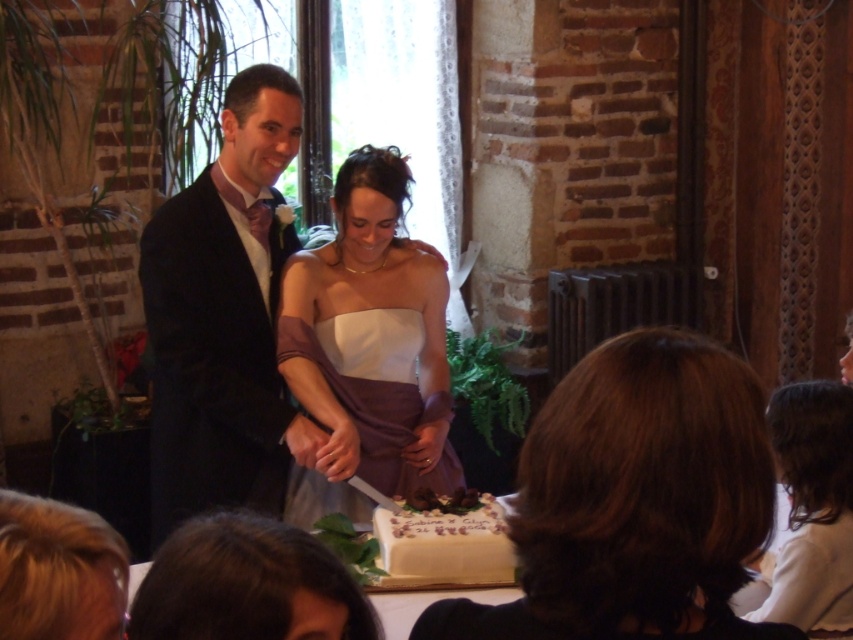
You are a photographer at the wedding. You need to adjust the lighting so that the white textured cake at center is well lit. The brown hair at center might cast a shadow on the cake. Based on their positions, should you move the light source to the left or right of the cake?

Since the brown hair at center is to the right of white textured cake at center, moving the light source to the right would cast a shadow away from the cake. Therefore, to avoid shadows, the light should be placed to the right of the white textured cake at center.

You are a photographer at the wedding and need to adjust the lighting to ensure both the brown hair at center and the white satin dress at center are well lit. Considering their sizes, which object might require more focused lighting adjustments?

The brown hair at center occupies less space than the white satin dress at center, so it might require more focused lighting adjustments to ensure it is properly illuminated compared to the larger dress.